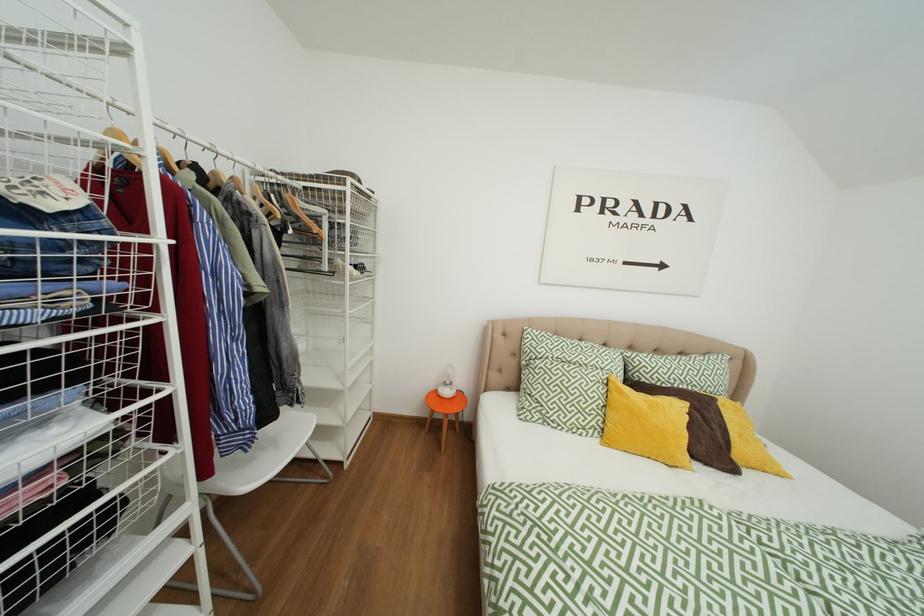
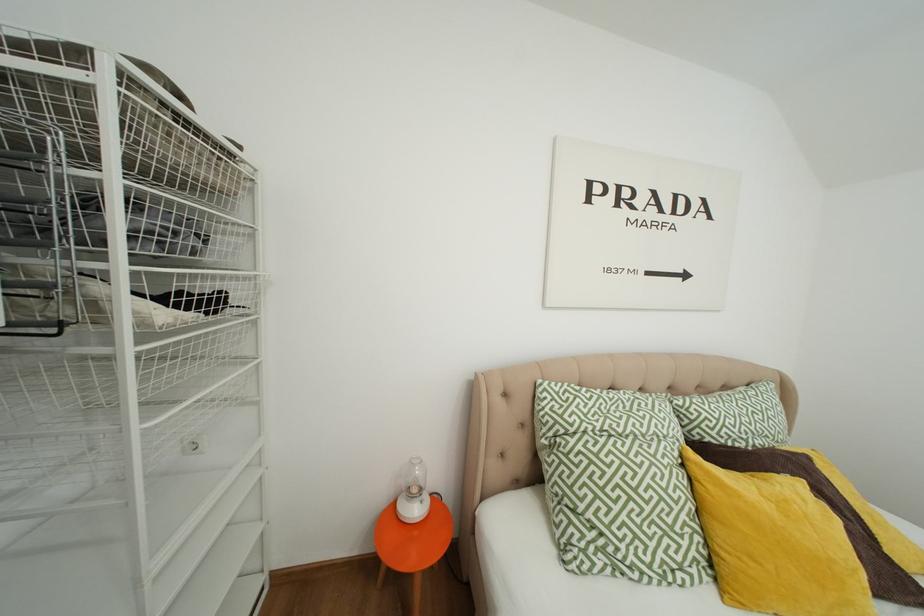
Question: The first image is from the beginning of the video and the second image is from the end. How did the camera likely rotate when shooting the video?

Choices:
 (A) Left
 (B) Right
 (C) Up
 (D) Down

Answer: (B)